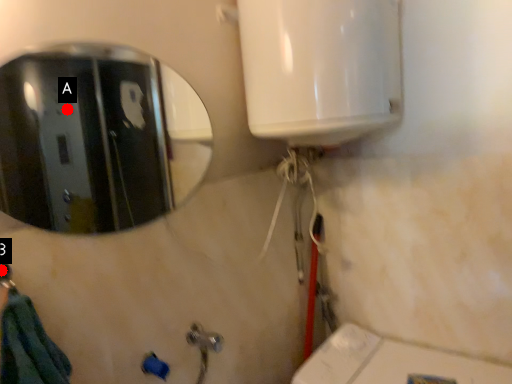
Question: Two points are circled on the image, labeled by A and B beside each circle. Which point is closer to the camera?

Choices:
 (A) A is closer
 (B) B is closer

Answer: (B)